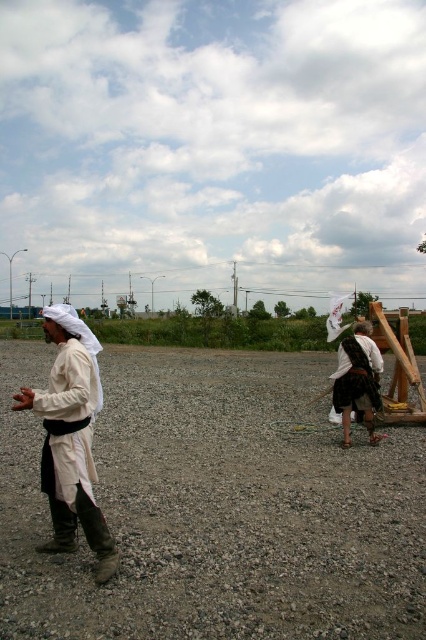
You are a photographer trying to capture the perfect shot of the white cotton robe at left. The camera you are using has a focal length of 50mm and an aperture of f2.8. If you want to focus on the robe, which is at point coordinates of 0.684 on the x axis and 0.167 on the y axis, what adjustments should you make to the camera settings to ensure the robe is in focus?

The white cotton robe at left is positioned at coordinates 0.684 on the x axis and 0.167 on the y axis. To ensure the robe is in focus, adjust the camera focus ring to align with the robe at those coordinates. The focal length of 50mm and aperture f2.8 provide a moderate depth of field, so precise focus adjustment is essential.

You are a photographer trying to capture a clear shot of the gray gravel at center and the white cotton robe at right. Based on their positions, which object will appear larger in your photo?

The gray gravel at center appears larger in the photo because it is closer to the viewer than the white cotton robe at right.

You are standing at the point marked as point (216,508) in the image. What material are you standing on?

The gray gravel at center is located at point (216,508), so you are standing on gray gravel.